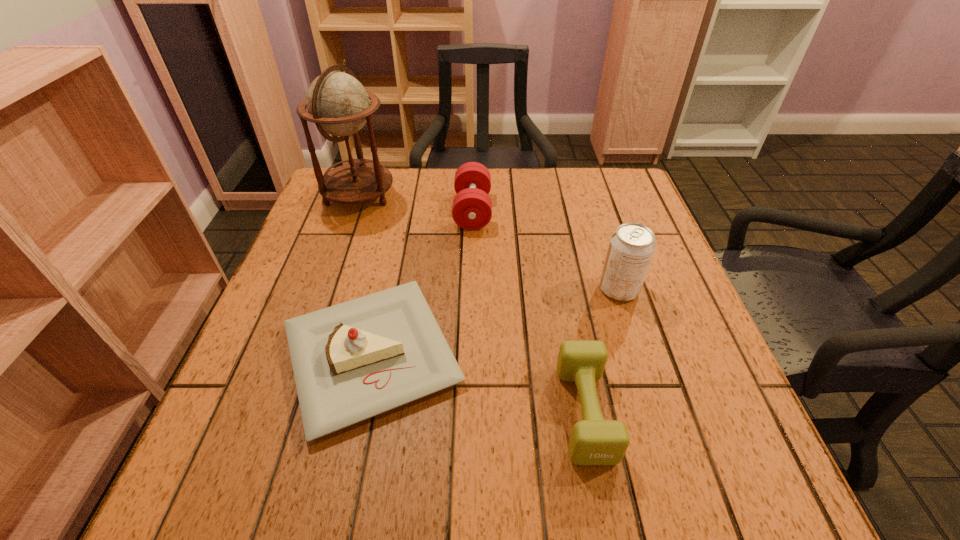
Locate an element on the screen. Image resolution: width=960 pixels, height=540 pixels. free space that satisfies the following two spatial constraints: 1. on the surface of the globe; 2. on the back side of the soda can is located at coordinates (325, 289).

What are the coordinates of `vacant space that satisfies the following two spatial constraints: 1. on the back side of the shorter dumbbell; 2. on the left side of the fourth shortest object` in the screenshot? It's located at (562, 289).

Image resolution: width=960 pixels, height=540 pixels. Find the location of `vacant area that satisfies the following two spatial constraints: 1. on the back side of the cake; 2. on the surface of the globe`. vacant area that satisfies the following two spatial constraints: 1. on the back side of the cake; 2. on the surface of the globe is located at coordinates click(x=406, y=195).

You are a GUI agent. You are given a task and a screenshot of the screen. Output one action in this format:
    pyautogui.click(x=<x>, y=<y>)
    Task: Click on the free space that satisfies the following two spatial constraints: 1. on the surface of the cake; 2. on the left side of the tallest object
    
    Given the screenshot: What is the action you would take?
    pyautogui.click(x=302, y=355)

The width and height of the screenshot is (960, 540). What are the coordinates of `vacant area in the image that satisfies the following two spatial constraints: 1. on the surface of the rightmost object; 2. on the left side of the tallest object` in the screenshot? It's located at (325, 289).